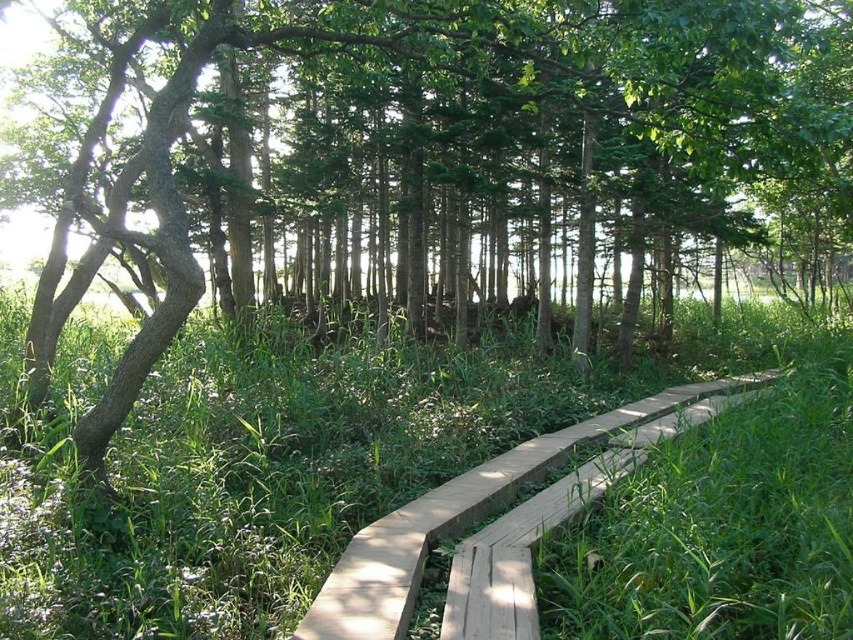
You are planning to place a small garden ornament that requires a space of at least 1 meter in width. Based on the scene, which area between the green grass at center and the natural wood boardwalk at center would be suitable for placing the ornament?

The green grass at center is larger in size than the natural wood boardwalk at center, so the green grass at center would be suitable for placing the ornament as it provides enough space.

You are a hiker who wants to walk on the natural wood boardwalk at center. However, you notice that the green grass at center is much taller than the boardwalk. Do you think the boardwalk is visible enough for you to step onto it safely?

The green grass at center is much taller than the natural wood boardwalk at center, which means the boardwalk might be partially hidden by the tall grass. This could make it difficult to see and step onto safely.

You are a hiker walking along the wooden pathway in the forest. You notice the green grass at center and the natural wood boardwalk at center. Which object is located to the left of the other?

The green grass at center is positioned on the left side of natural wood boardwalk at center, so the green grass at center is to the left of the natural wood boardwalk at center.